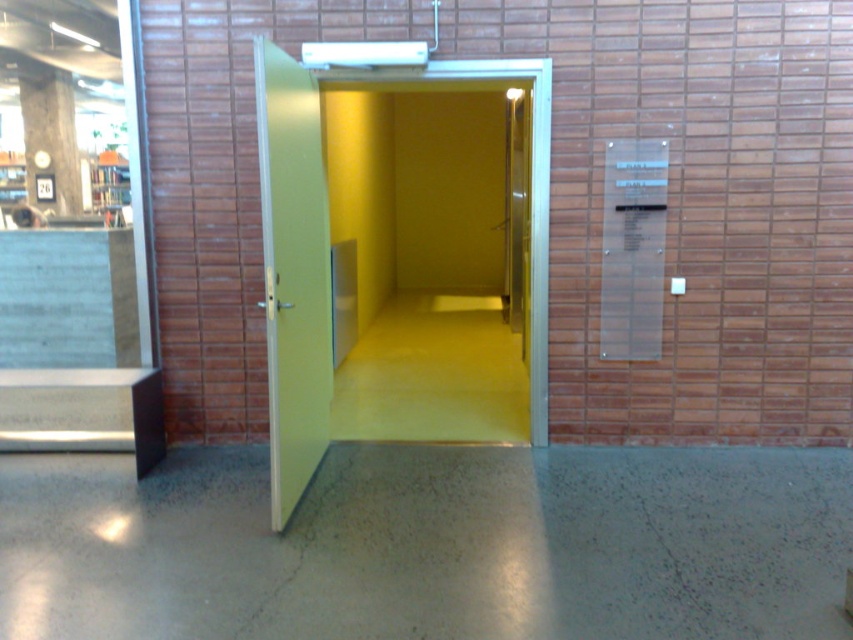
Question: Among these objects, which one is nearest to the camera?

Choices:
 (A) green matte elevator at center
 (B) green matte door at center
 (C) concrete at left

Answer: (B)

Question: Which of these objects is positioned farthest from the green matte door at center?

Choices:
 (A) green matte elevator at center
 (B) concrete at left

Answer: (B)

Question: Can you confirm if green matte door at center is wider than concrete at left?

Choices:
 (A) yes
 (B) no

Answer: (B)

Question: Which object appears farthest from the camera in this image?

Choices:
 (A) green matte door at center
 (B) concrete at left
 (C) green matte elevator at center

Answer: (B)

Question: Is green matte door at center thinner than concrete at left?

Choices:
 (A) no
 (B) yes

Answer: (B)

Question: Where is green matte door at center located in relation to green matte elevator at center in the image?

Choices:
 (A) above
 (B) below

Answer: (B)